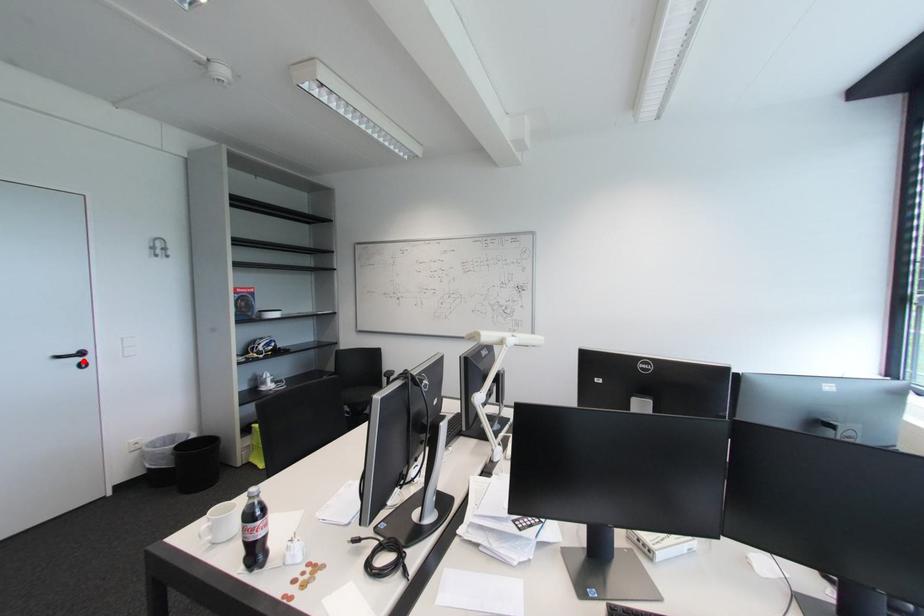
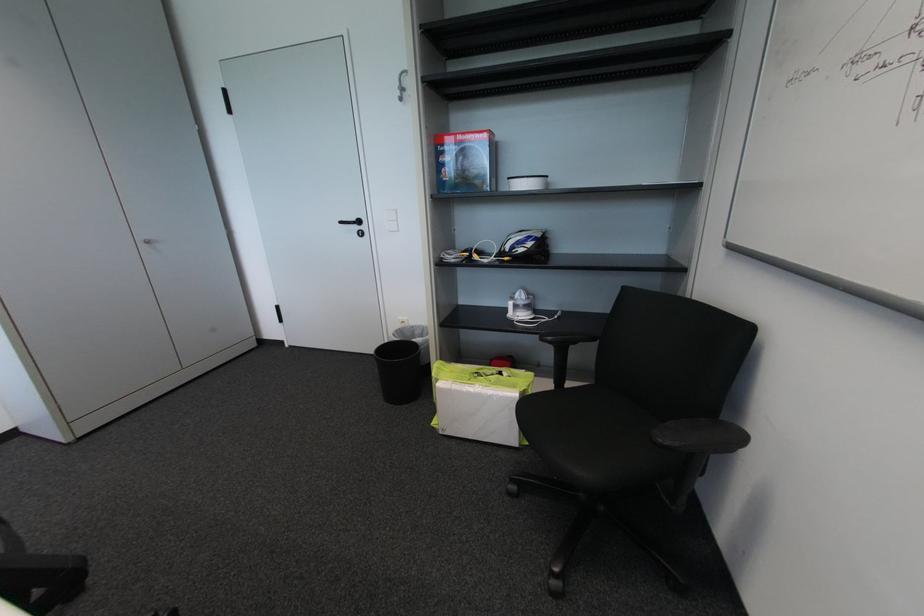
Where in the second image is the point corresponding to the highlighted location from the first image?

(362, 229)